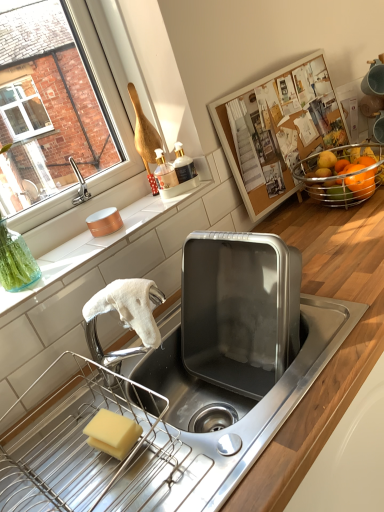
Where is `blank space above white matte towel at left, which is counted as the 2th countertop, starting from the bottom (from a real-world perspective)`? The image size is (384, 512). blank space above white matte towel at left, which is counted as the 2th countertop, starting from the bottom (from a real-world perspective) is located at coordinates (102, 233).